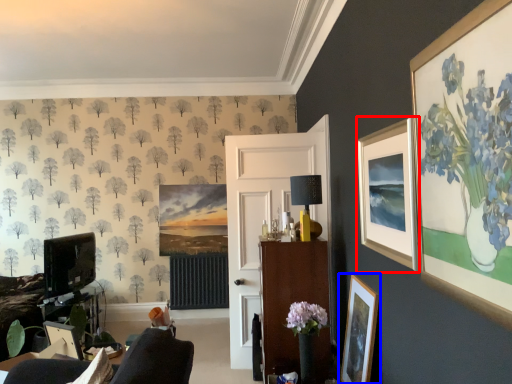
Question: Which of the following is the farthest to the observer, picture frame (highlighted by a red box) or picture frame (highlighted by a blue box)?

Choices:
 (A) picture frame
 (B) picture frame

Answer: (B)